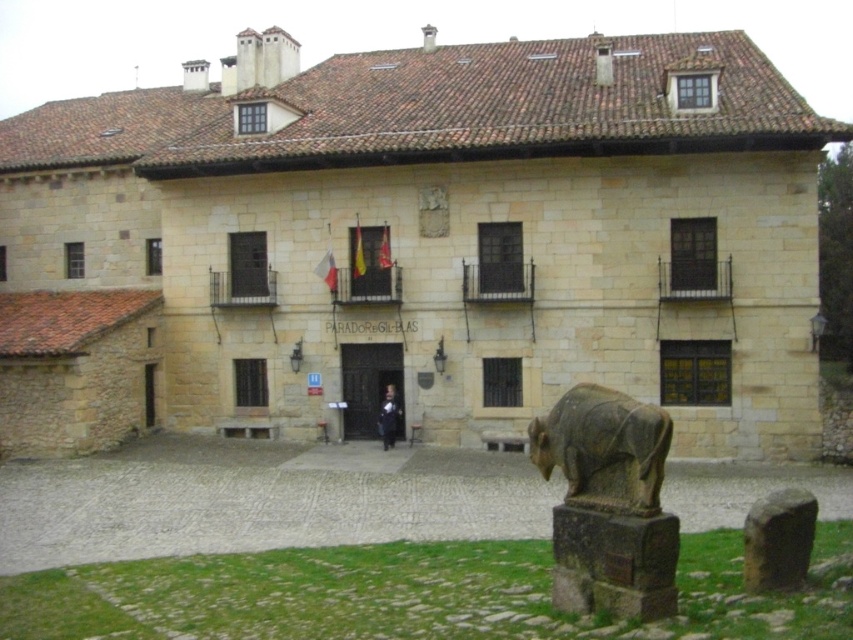
Based on the photo, does gray stone bear at lower right lie in front of dark blue fabric coat at center?

Yes.

Can you confirm if gray stone bear at lower right is thinner than dark blue fabric coat at center?

Incorrect, gray stone bear at lower right's width is not less than dark blue fabric coat at center's.

This screenshot has width=853, height=640. What do you see at coordinates (608, 502) in the screenshot?
I see `gray stone bear at lower right` at bounding box center [608, 502].

The width and height of the screenshot is (853, 640). What are the coordinates of `gray stone bear at lower right` in the screenshot? It's located at (608, 502).